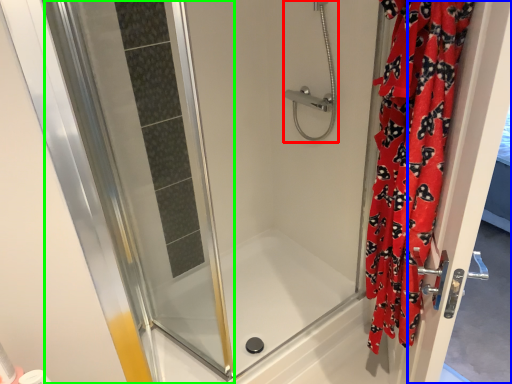
Question: Estimate the real-world distances between objects in this image. Which object is farther from shower (highlighted by a red box), screen door (highlighted by a blue box) or screen door (highlighted by a green box)?

Choices:
 (A) screen door
 (B) screen door

Answer: (A)